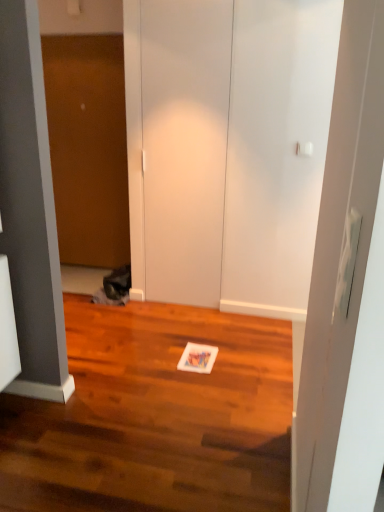
Locate an element on the screen. The height and width of the screenshot is (512, 384). empty space that is ontop of wooden door at left, the second door from the front is located at coordinates (78, 36).